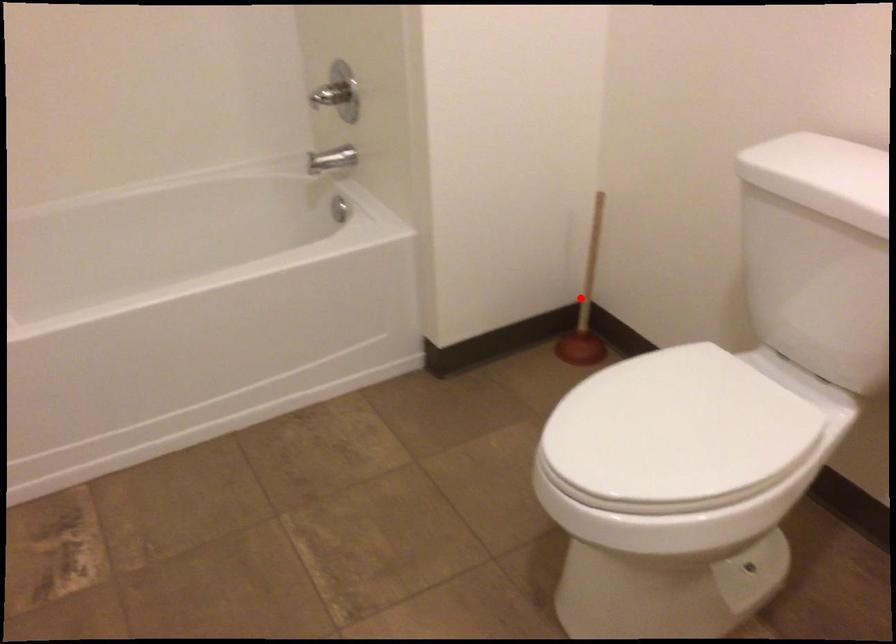
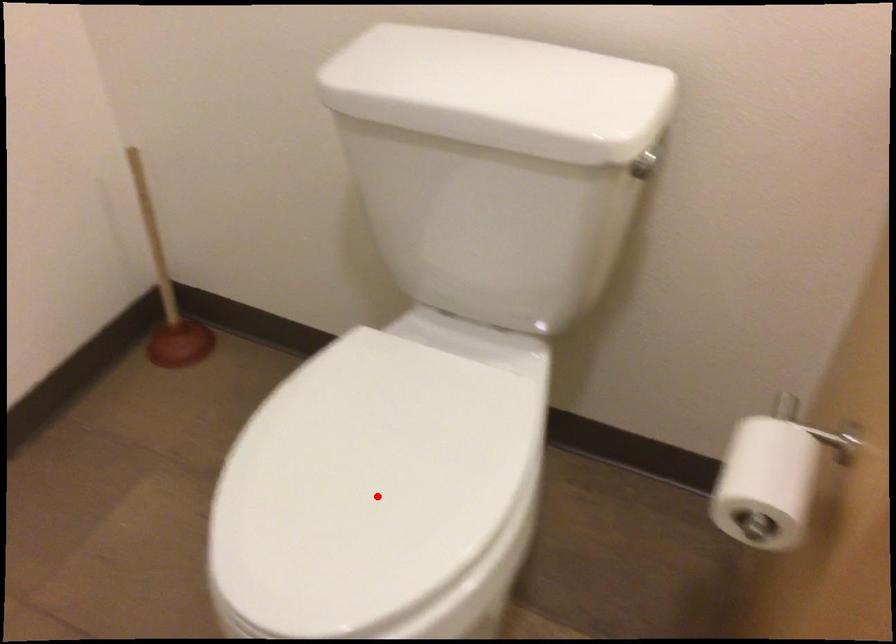
I am providing you with two images of the same scene from different viewpoints. A red point is marked on the first image and another point is marked on the second image. Are the points marked in image1 and image2 representing the same 3D position?

No